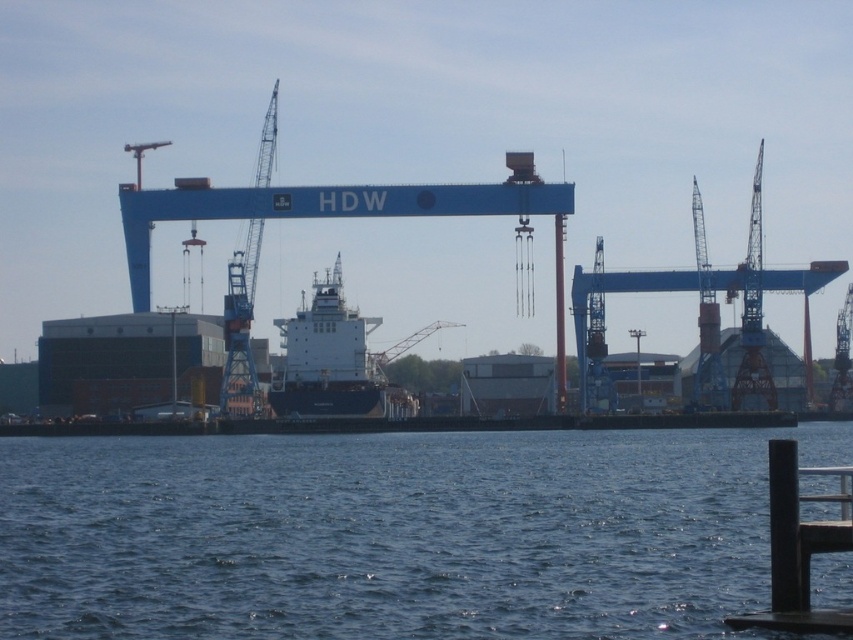
You are a crane operator who needs to move a container from the black metal dock at lower right to the blue metallic crane at center. Given the distance between them is 142.17 meters, can you estimate how long it will take for the crane to reach the dock if it moves at a constant speed of 0.5 meters per second?

The distance between the black metal dock at lower right and the blue metallic crane at center is 142.17 meters. At a speed of 0.5 meters per second, the time required would be 142.17 divided by 0.5, which equals approximately 284.34 seconds, or roughly 4 minutes and 44 seconds.

You are a crane operator at the shipyard. You need to lower a heavy load onto the white matte ship at center. The blue metallic crane at center is directly above it. Is there enough vertical clearance between the crane and the ship to safely perform this task?

The white matte ship at center is located below the blue metallic crane at center, so there is sufficient vertical clearance to safely lower the load onto the ship without collision.

You are a crane operator who needs to move a heavy container from the blue metallic crane at center to the black metal dock at lower right. Based on the scene, which direction should you move the container to reach the dock?

The black metal dock at lower right is to the right of the blue metallic crane at center, so you should move the container to the right to reach the dock.